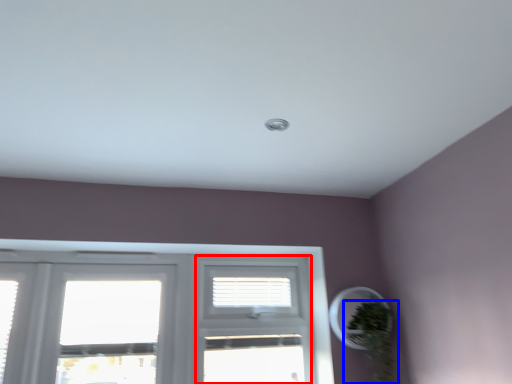
Question: Which object is closer to the camera taking this photo, screen door (highlighted by a red box) or houseplant (highlighted by a blue box)?

Choices:
 (A) screen door
 (B) houseplant

Answer: (B)